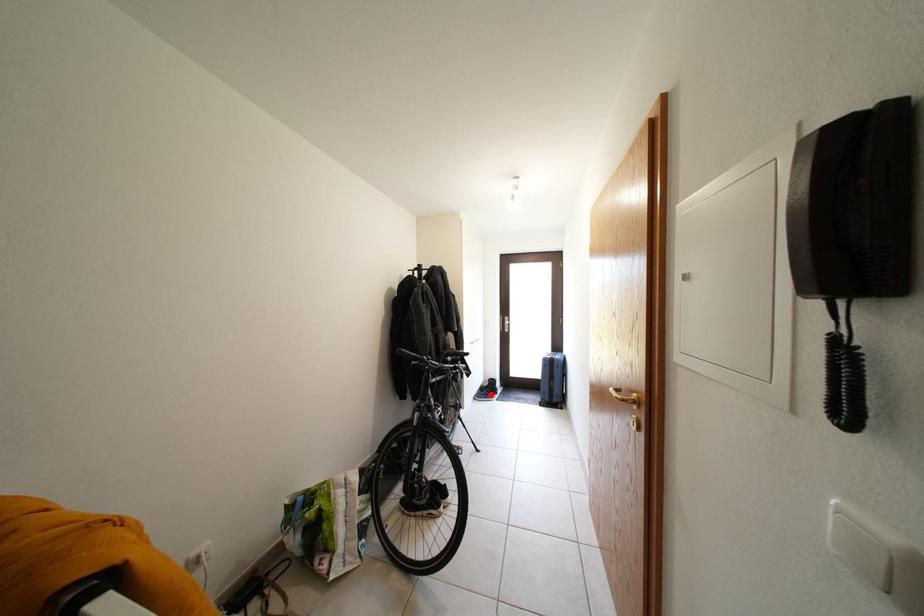
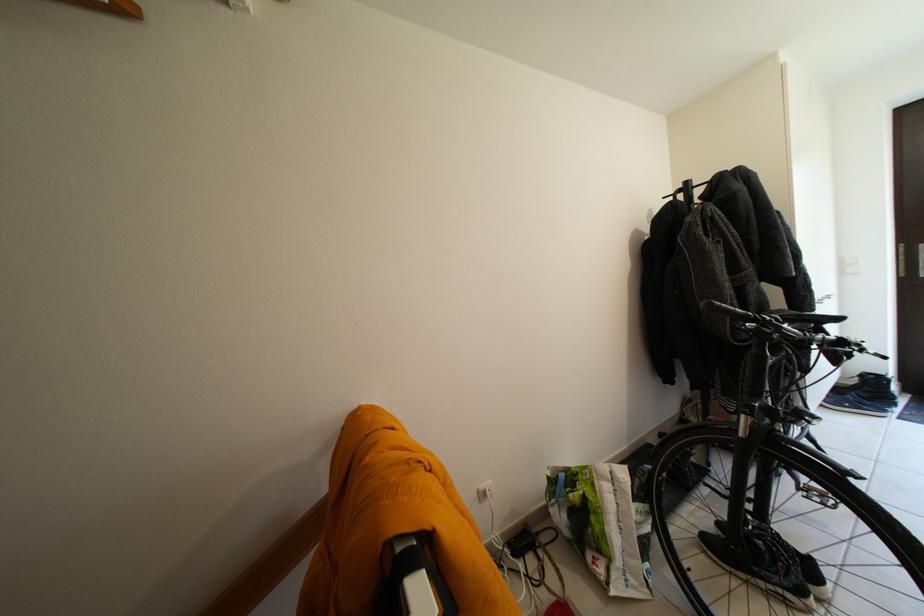
Question: I am providing you with two images of the same scene from different viewpoints. Image1 has a red point marked. In image2, the corresponding 3D location appears at what relative position? Reply with the corresponding letter.

Choices:
 (A) Closer
 (B) Farther

Answer: (A)